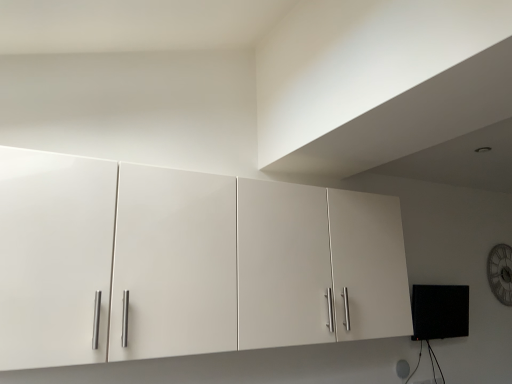
Describe the element at coordinates (500, 273) in the screenshot. The width and height of the screenshot is (512, 384). I see `wooden clock at upper right` at that location.

Find the location of a particular element. wooden clock at upper right is located at coordinates (500, 273).

Identify the location of white glossy cabinet at upper center. (187, 262).

This screenshot has width=512, height=384. What do you see at coordinates (187, 262) in the screenshot?
I see `white glossy cabinet at upper center` at bounding box center [187, 262].

At what (x,y) coordinates should I click in order to perform the action: click on wooden clock at upper right. Please return your answer as a coordinate pair (x, y). Looking at the image, I should click on (500, 273).

Is white glossy cabinet at upper center to the left of wooden clock at upper right from the viewer's perspective?

Correct, you'll find white glossy cabinet at upper center to the left of wooden clock at upper right.

Considering their positions, is white glossy cabinet at upper center located in front of or behind wooden clock at upper right?

white glossy cabinet at upper center is in front of wooden clock at upper right.

Is point (239, 214) closer to viewer compared to point (499, 264)?

Yes, point (239, 214) is in front of point (499, 264).

From the image's perspective, is white glossy cabinet at upper center over wooden clock at upper right?

Yes, from the image's perspective, white glossy cabinet at upper center is over wooden clock at upper right.

From a real-world perspective, is white glossy cabinet at upper center positioned under wooden clock at upper right based on gravity?

No, from a real-world perspective, white glossy cabinet at upper center is not beneath wooden clock at upper right.

Does white glossy cabinet at upper center have a greater width compared to wooden clock at upper right?

Yes.

Consider the image. Who is shorter, white glossy cabinet at upper center or wooden clock at upper right?

wooden clock at upper right is shorter.

Can you confirm if white glossy cabinet at upper center is smaller than wooden clock at upper right?

No.

Is white glossy cabinet at upper center located outside wooden clock at upper right?

Yes, white glossy cabinet at upper center is outside of wooden clock at upper right.

In the scene shown: Is white glossy cabinet at upper center far away from wooden clock at upper right?

Indeed, white glossy cabinet at upper center is not near wooden clock at upper right.

Is white glossy cabinet at upper center oriented away from wooden clock at upper right?

That's not correct — white glossy cabinet at upper center is not looking away from wooden clock at upper right.

The image size is (512, 384). In order to click on cupboard that appears in front of the wooden clock at upper right in this screenshot , I will do coord(187,262).

Is wooden clock at upper right to the left of white glossy cabinet at upper center from the viewer's perspective?

No.

Which is behind, wooden clock at upper right or white glossy cabinet at upper center?

wooden clock at upper right is more distant.

Is point (504, 273) farther from viewer compared to point (254, 296)?

Yes, it is.

From the image's perspective, is wooden clock at upper right above or below white glossy cabinet at upper center?

wooden clock at upper right is situated lower than white glossy cabinet at upper center in the image.

From a real-world perspective, who is located higher, wooden clock at upper right or white glossy cabinet at upper center?

In real-world perspective, white glossy cabinet at upper center is above.

Considering the relative sizes of wooden clock at upper right and white glossy cabinet at upper center in the image provided, is wooden clock at upper right thinner than white glossy cabinet at upper center?

Indeed, wooden clock at upper right has a lesser width compared to white glossy cabinet at upper center.

Is wooden clock at upper right taller or shorter than white glossy cabinet at upper center?

Considering their sizes, wooden clock at upper right has less height than white glossy cabinet at upper center.

Does wooden clock at upper right have a larger size compared to white glossy cabinet at upper center?

Incorrect, wooden clock at upper right is not larger than white glossy cabinet at upper center.

Do you think wooden clock at upper right is within white glossy cabinet at upper center, or outside of it?

wooden clock at upper right is outside white glossy cabinet at upper center.

Is wooden clock at upper right far away from white glossy cabinet at upper center?

wooden clock at upper right is far away from white glossy cabinet at upper center.

Is wooden clock at upper right positioned with its back to white glossy cabinet at upper center?

That's not correct — wooden clock at upper right is not looking away from white glossy cabinet at upper center.

The width and height of the screenshot is (512, 384). I want to click on clock behind the white glossy cabinet at upper center, so click(x=500, y=273).

You are a GUI agent. You are given a task and a screenshot of the screen. Output one action in this format:
    pyautogui.click(x=<x>, y=<y>)
    Task: Click on the clock lying below the white glossy cabinet at upper center (from the image's perspective)
    
    Given the screenshot: What is the action you would take?
    pyautogui.click(x=500, y=273)

The height and width of the screenshot is (384, 512). In order to click on clock that is on the right side of white glossy cabinet at upper center in this screenshot , I will do `click(500, 273)`.